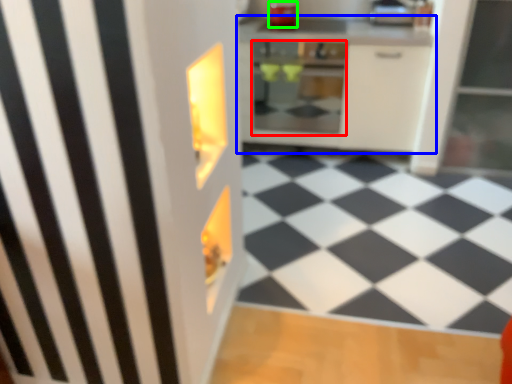
Question: Which is nearer to the oven (highlighted by a red box)? cabinetry (highlighted by a blue box) or appliance (highlighted by a green box).

Choices:
 (A) cabinetry
 (B) appliance

Answer: (A)